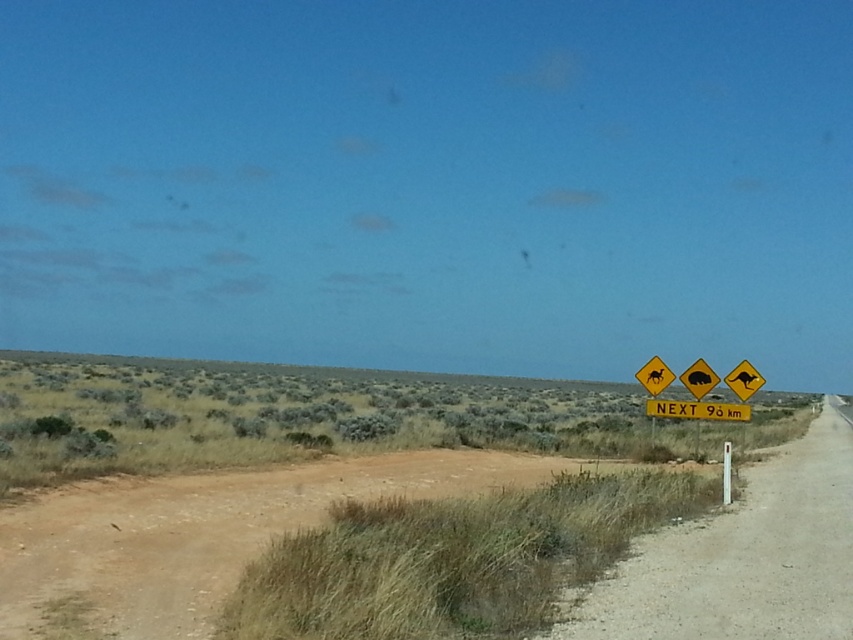
Question: Is brown dirt track at lower left above yellow plastic kangaroo sign at right?

Choices:
 (A) yes
 (B) no

Answer: (B)

Question: Considering the real-world distances, which object is closest to the brown dirt track at lower left?

Choices:
 (A) yellow plastic camel at upper right
 (B) yellow plastic kangaroo sign at right
 (C) yellow matte kangaroo sign at center

Answer: (C)

Question: Which of the following is the farthest from the observer?

Choices:
 (A) yellow plastic camel at upper right
 (B) brown dirt track at lower left
 (C) yellow matte kangaroo sign at center

Answer: (A)

Question: Which point is closer to the camera taking this photo?

Choices:
 (A) (735, 374)
 (B) (769, 529)
 (C) (729, 472)

Answer: (B)

Question: Is yellow plastic camel at upper right to the right of white plastic pole at right from the viewer's perspective?

Choices:
 (A) no
 (B) yes

Answer: (B)

Question: Is yellow plastic sign at right positioned at the back of white plastic pole at right?

Choices:
 (A) no
 (B) yes

Answer: (A)